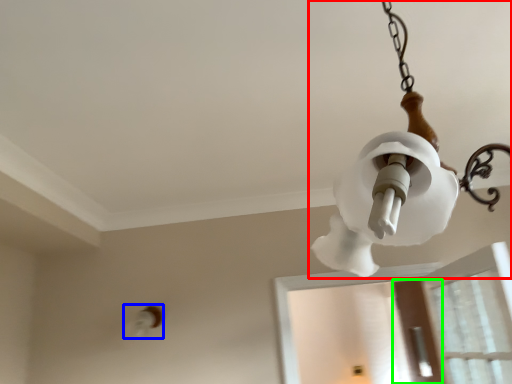
Question: Which is farther away from lamp (highlighted by a red box)? light fixture (highlighted by a blue box) or screen door (highlighted by a green box)?

Choices:
 (A) light fixture
 (B) screen door

Answer: (B)